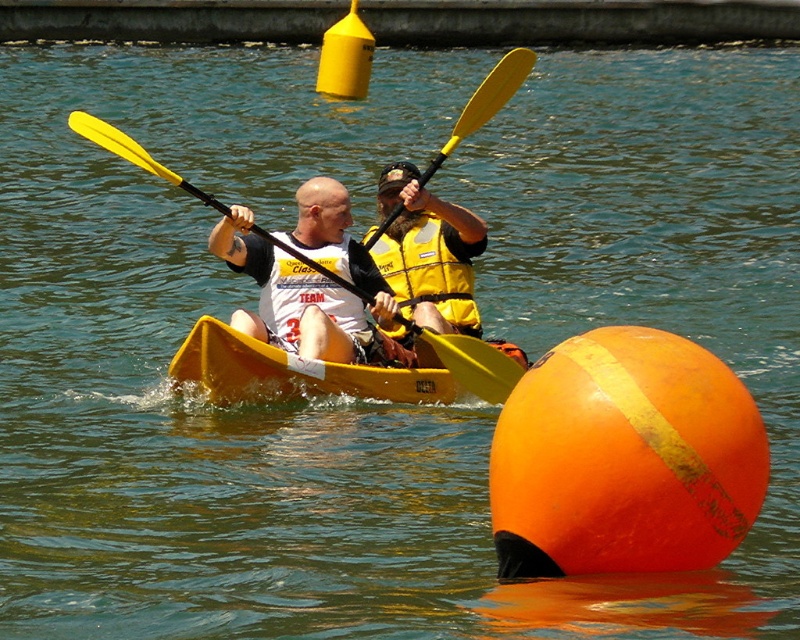
Question: Is yellow matte life jacket at center positioned in front of yellow matte paddle at center?

Choices:
 (A) no
 (B) yes

Answer: (A)

Question: Does yellow matte life jacket at center appear on the left side of yellow matte paddle at center?

Choices:
 (A) no
 (B) yes

Answer: (A)

Question: Which point is farther to the camera?

Choices:
 (A) (490, 397)
 (B) (448, 307)

Answer: (B)

Question: Which point appears farthest from the camera in this image?

Choices:
 (A) (325, 340)
 (B) (113, 128)
 (C) (442, 296)

Answer: (B)

Question: Which of the following is the farthest from the observer?

Choices:
 (A) yellow matte life jacket at center
 (B) yellow matte paddle at center

Answer: (A)

Question: Does white matte shirt at center come behind yellow matte paddle at center?

Choices:
 (A) no
 (B) yes

Answer: (B)